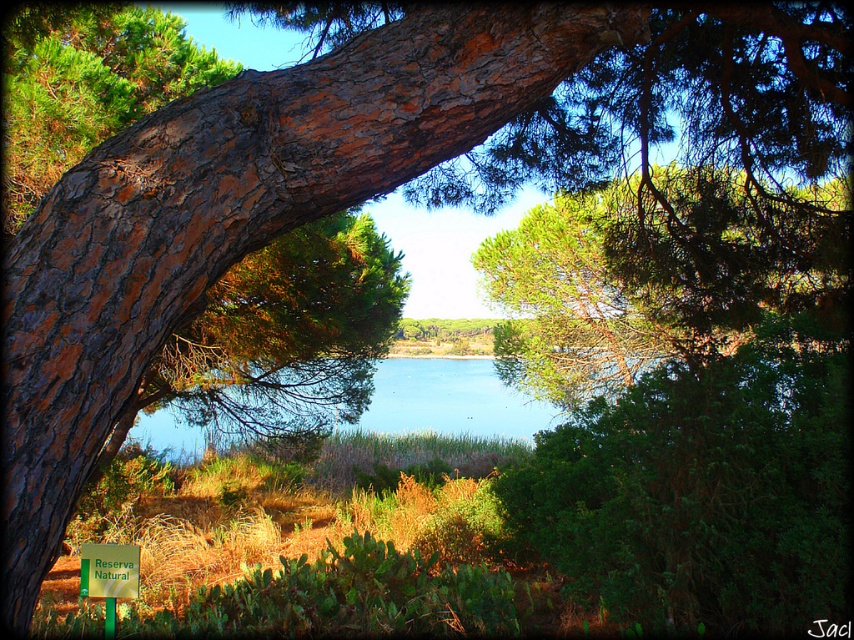
Does blue water at center appear on the right side of green plastic sign at center?

Correct, you'll find blue water at center to the right of green plastic sign at center.

Is point (472, 385) behind point (137, 579)?

That is True.

The width and height of the screenshot is (854, 640). I want to click on blue water at center, so click(x=449, y=400).

This screenshot has width=854, height=640. In order to click on blue water at center in this screenshot , I will do `click(449, 400)`.